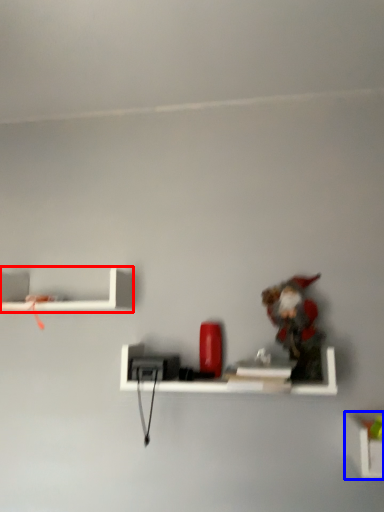
Question: Which point is closer to the camera, shelf (highlighted by a red box) or shelf (highlighted by a blue box)?

Choices:
 (A) shelf
 (B) shelf

Answer: (B)